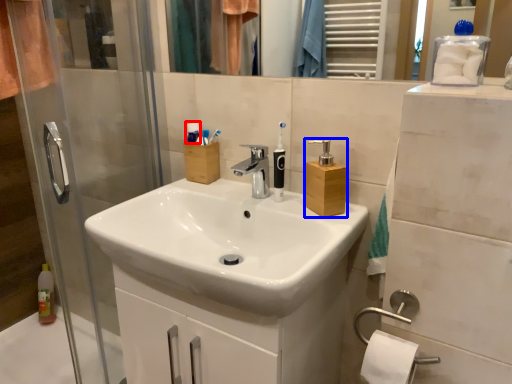
Question: Which point is further to the camera, toiletry (highlighted by a red box) or soap dispenser (highlighted by a blue box)?

Choices:
 (A) toiletry
 (B) soap dispenser

Answer: (A)